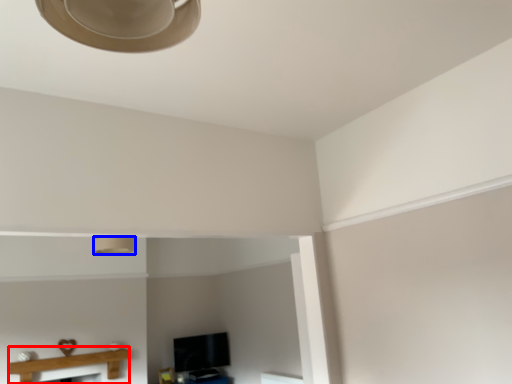
Question: Which object appears closest to the camera in this image, table (highlighted by a red box) or lamp (highlighted by a blue box)?

Choices:
 (A) table
 (B) lamp

Answer: (B)